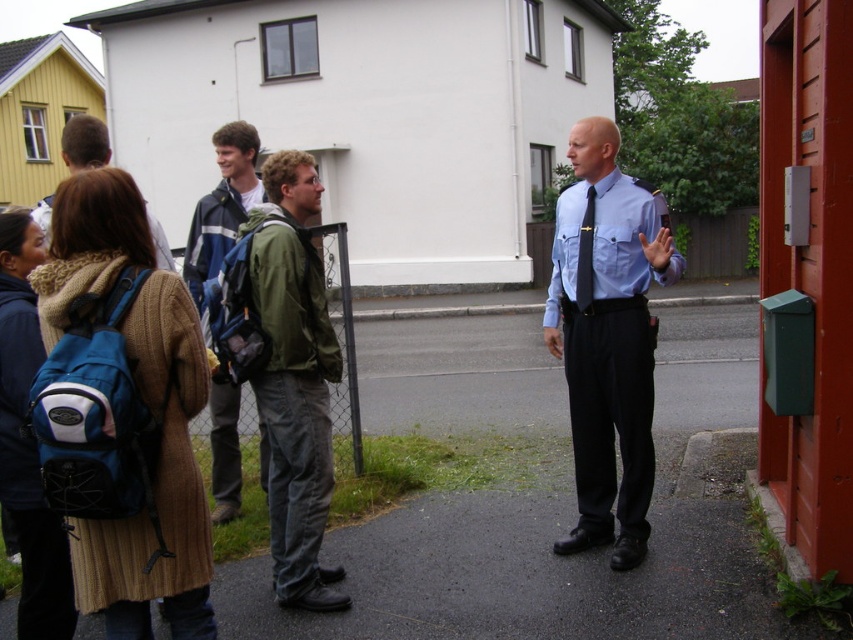
Is light blue shirt at center in front of blue backpack at center?

Yes, light blue shirt at center is in front of blue backpack at center.

At what (x,y) coordinates should I click in order to perform the action: click on light blue shirt at center. Please return your answer as a coordinate pair (x, y). The image size is (853, 640). Looking at the image, I should click on (607, 336).

This screenshot has width=853, height=640. Identify the location of light blue shirt at center. (607, 336).

Is light blue shirt at center positioned at the back of green matte jacket at center?

No, light blue shirt at center is in front of green matte jacket at center.

Can you confirm if light blue shirt at center is positioned to the right of green matte jacket at center?

Yes, light blue shirt at center is to the right of green matte jacket at center.

Who is more forward, [611,150] or [283,369]?

Point [283,369]

The height and width of the screenshot is (640, 853). Find the location of `light blue shirt at center`. light blue shirt at center is located at coordinates (607, 336).

How far apart are green matte jacket at center and blue backpack at center?

The distance of green matte jacket at center from blue backpack at center is 3.95 feet.

At what (x,y) coordinates should I click in order to perform the action: click on green matte jacket at center. Please return your answer as a coordinate pair (x, y). This screenshot has width=853, height=640. Looking at the image, I should click on (296, 420).